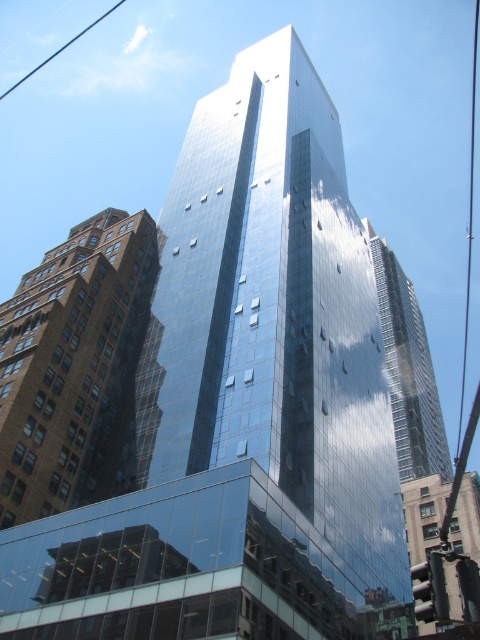
You are an architect evaluating the urban layout. Given the brown brick building at left and the shiny glass skyscraper at center, which structure occupies a smaller horizontal space from side to side?

The brown brick building at left has a lesser width compared to the shiny glass skyscraper at center, so it occupies a smaller horizontal space from side to side.

You are an architect analyzing the urban skyline. Based on the image, which building is taller between the brown brick building at left and the shiny glass skyscraper at center?

The shiny glass skyscraper at center is taller than the brown brick building at left according to the description.